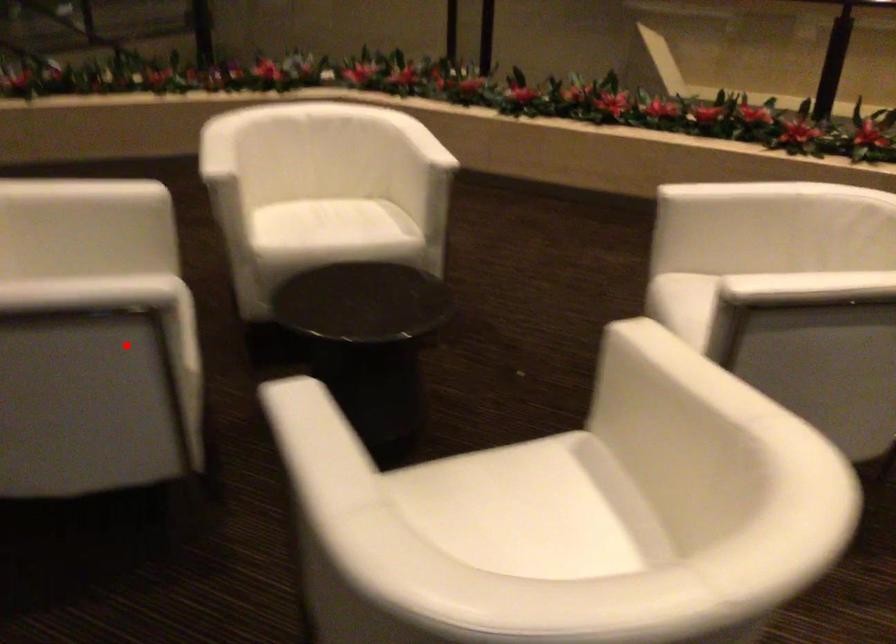
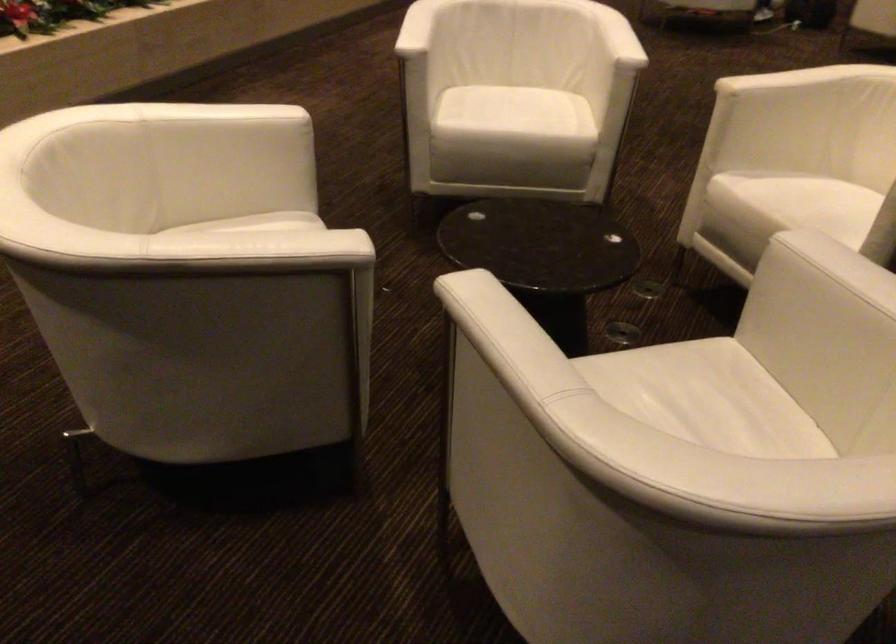
Find the pixel in the second image that matches the highlighted location in the first image.

(686, 388)